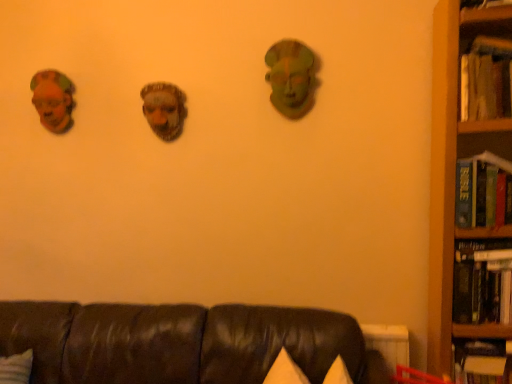
Question: Could you tell me if hardcover book at right, which is the fourth book from bottom to top, is turned towards hardcover book at right, positioned as the 2th book in bottom-to-top order?

Choices:
 (A) yes
 (B) no

Answer: (B)

Question: Are hardcover book at right, arranged as the 1th book when viewed from the top, and hardcover book at right, positioned as the 2th book in bottom-to-top order, far apart?

Choices:
 (A) no
 (B) yes

Answer: (A)

Question: Considering the relative sizes of hardcover book at right, arranged as the 1th book when viewed from the top, and hardcover book at right, marked as the third book in a top-to-bottom arrangement, in the image provided, is hardcover book at right, arranged as the 1th book when viewed from the top, bigger than hardcover book at right, marked as the third book in a top-to-bottom arrangement,?

Choices:
 (A) yes
 (B) no

Answer: (B)

Question: Does hardcover book at right, arranged as the 1th book when viewed from the top, have a smaller size compared to hardcover book at right, positioned as the 2th book in bottom-to-top order?

Choices:
 (A) yes
 (B) no

Answer: (A)

Question: From the image's perspective, is hardcover book at right, arranged as the 1th book when viewed from the top, on hardcover book at right, marked as the third book in a top-to-bottom arrangement?

Choices:
 (A) yes
 (B) no

Answer: (A)

Question: Is hardcover book at right, which is the fourth book from bottom to top, beside hardcover book at right, marked as the third book in a top-to-bottom arrangement?

Choices:
 (A) yes
 (B) no

Answer: (B)

Question: From the image's perspective, is hardcover book at right, acting as the 4th book starting from the top, below hardcover book at right, which is the fourth book from bottom to top?

Choices:
 (A) no
 (B) yes

Answer: (B)

Question: Is hardcover book at right, acting as the 4th book starting from the top, in contact with hardcover book at right, arranged as the 1th book when viewed from the top?

Choices:
 (A) yes
 (B) no

Answer: (B)

Question: Considering the relative sizes of hardcover book at right, which is the first book in bottom-to-top order, and hardcover book at right, which is the fourth book from bottom to top, in the image provided, is hardcover book at right, which is the first book in bottom-to-top order, smaller than hardcover book at right, which is the fourth book from bottom to top,?

Choices:
 (A) no
 (B) yes

Answer: (A)

Question: Is hardcover book at right, acting as the 4th book starting from the top, not within hardcover book at right, which is the fourth book from bottom to top?

Choices:
 (A) yes
 (B) no

Answer: (A)

Question: Does hardcover book at right, acting as the 4th book starting from the top, come behind hardcover book at right, which is the fourth book from bottom to top?

Choices:
 (A) yes
 (B) no

Answer: (A)

Question: Is the depth of hardcover book at right, which is the first book in bottom-to-top order, less than that of hardcover book at right, arranged as the 1th book when viewed from the top?

Choices:
 (A) yes
 (B) no

Answer: (B)

Question: Does wooden bookcase at right have a lesser height compared to matte brown mask at left?

Choices:
 (A) no
 (B) yes

Answer: (A)